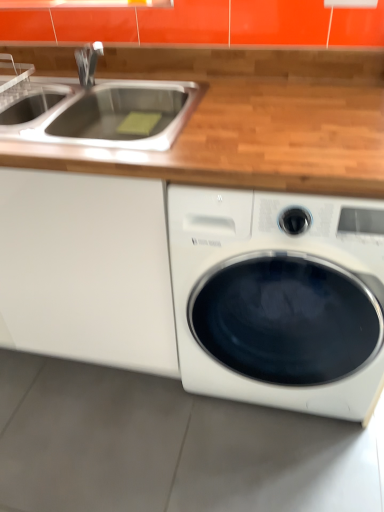
What do you see at coordinates (92, 104) in the screenshot? The height and width of the screenshot is (512, 384). I see `stainless steel sink at upper left` at bounding box center [92, 104].

Measure the distance between stainless steel sink at upper left and camera.

The depth of stainless steel sink at upper left is 38.86 inches.

Measure the distance between white glossy washing machine at lower right and camera.

white glossy washing machine at lower right and camera are 35.37 inches apart from each other.

In order to click on white matte cabinet at left in this screenshot , I will do `click(86, 269)`.

From a real-world perspective, is stainless steel sink at upper left physically located above or below white matte cabinet at left?

stainless steel sink at upper left is above white matte cabinet at left.

Which is behind, point (3, 96) or point (151, 206)?

The point (3, 96) is behind.

Is stainless steel sink at upper left shorter than white matte cabinet at left?

Yes, stainless steel sink at upper left is shorter than white matte cabinet at left.

Considering the sizes of objects white glossy washing machine at lower right and stainless steel sink at upper left in the image provided, who is taller, white glossy washing machine at lower right or stainless steel sink at upper left?

With more height is white glossy washing machine at lower right.

Considering the relative positions of white glossy washing machine at lower right and stainless steel sink at upper left in the image provided, is white glossy washing machine at lower right to the right of stainless steel sink at upper left from the viewer's perspective?

Yes.

Is the position of white glossy washing machine at lower right less distant than that of stainless steel sink at upper left?

Yes, white glossy washing machine at lower right is in front of stainless steel sink at upper left.

From the image's perspective, which is below, white glossy washing machine at lower right or stainless steel sink at upper left?

From the image's view, white glossy washing machine at lower right is below.

Is white matte cabinet at left positioned far away from white glossy washing machine at lower right?

No, white matte cabinet at left is not far from white glossy washing machine at lower right.

In the image, is white matte cabinet at left positioned in front of or behind white glossy washing machine at lower right?

Visually, white matte cabinet at left is located behind white glossy washing machine at lower right.

Which object is positioned more to the right, white matte cabinet at left or white glossy washing machine at lower right?

white glossy washing machine at lower right.

Identify the location of cabinetry above the white glossy washing machine at lower right (from the image's perspective). The image size is (384, 512). (86, 269).

Is stainless steel sink at upper left smaller than white glossy washing machine at lower right?

Yes.

Between point (176, 125) and point (292, 396), which one is positioned in front?

Positioned in front is point (176, 125).

Is stainless steel sink at upper left inside or outside of white glossy washing machine at lower right?

stainless steel sink at upper left lies outside white glossy washing machine at lower right.

Could you tell me if stainless steel sink at upper left is facing white glossy washing machine at lower right?

No, stainless steel sink at upper left is not turned towards white glossy washing machine at lower right.

Is white glossy washing machine at lower right next to white matte cabinet at left?

No, white glossy washing machine at lower right is not in contact with white matte cabinet at left.

From a real-world perspective, is white glossy washing machine at lower right below white matte cabinet at left?

Actually, white glossy washing machine at lower right is physically above white matte cabinet at left in the real world.

Does point (349, 384) come farther from viewer compared to point (33, 242)?

Yes, it is.

Is white glossy washing machine at lower right situated inside white matte cabinet at left or outside?

white glossy washing machine at lower right cannot be found inside white matte cabinet at left.

Is white matte cabinet at left shorter than stainless steel sink at upper left?

In fact, white matte cabinet at left may be taller than stainless steel sink at upper left.

Is white matte cabinet at left aimed at stainless steel sink at upper left?

No, white matte cabinet at left is not aimed at stainless steel sink at upper left.

You are a GUI agent. You are given a task and a screenshot of the screen. Output one action in this format:
    pyautogui.click(x=<x>, y=<y>)
    Task: Click on the cabinetry below the stainless steel sink at upper left (from the image's perspective)
    
    Given the screenshot: What is the action you would take?
    pos(86,269)

You are a GUI agent. You are given a task and a screenshot of the screen. Output one action in this format:
    pyautogui.click(x=<x>, y=<y>)
    Task: Click on the cabinetry on the left of stainless steel sink at upper left
    Image resolution: width=384 pixels, height=512 pixels.
    Given the screenshot: What is the action you would take?
    pyautogui.click(x=86, y=269)

Locate an element on the screen. washing machine on the right of stainless steel sink at upper left is located at coordinates (277, 300).

When comparing their distances from white glossy washing machine at lower right, does white matte cabinet at left or stainless steel sink at upper left seem further?

Based on the image, stainless steel sink at upper left appears to be further to white glossy washing machine at lower right.

Looking at the image, which one is located closer to white matte cabinet at left, white glossy washing machine at lower right or stainless steel sink at upper left?

The object closer to white matte cabinet at left is white glossy washing machine at lower right.

Estimate the real-world distances between objects in this image. Which object is closer to white matte cabinet at left, stainless steel sink at upper left or white glossy washing machine at lower right?

white glossy washing machine at lower right.

Estimate the real-world distances between objects in this image. Which object is closer to stainless steel sink at upper left, white glossy washing machine at lower right or white matte cabinet at left?

white matte cabinet at left.

Based on their spatial positions, is stainless steel sink at upper left or white matte cabinet at left closer to white glossy washing machine at lower right?

white matte cabinet at left is closer to white glossy washing machine at lower right.

When comparing their distances from stainless steel sink at upper left, does white matte cabinet at left or white glossy washing machine at lower right seem closer?

white matte cabinet at left is closer to stainless steel sink at upper left.

Image resolution: width=384 pixels, height=512 pixels. In order to click on sink between white matte cabinet at left and white glossy washing machine at lower right from left to right in this screenshot , I will do `click(92, 104)`.